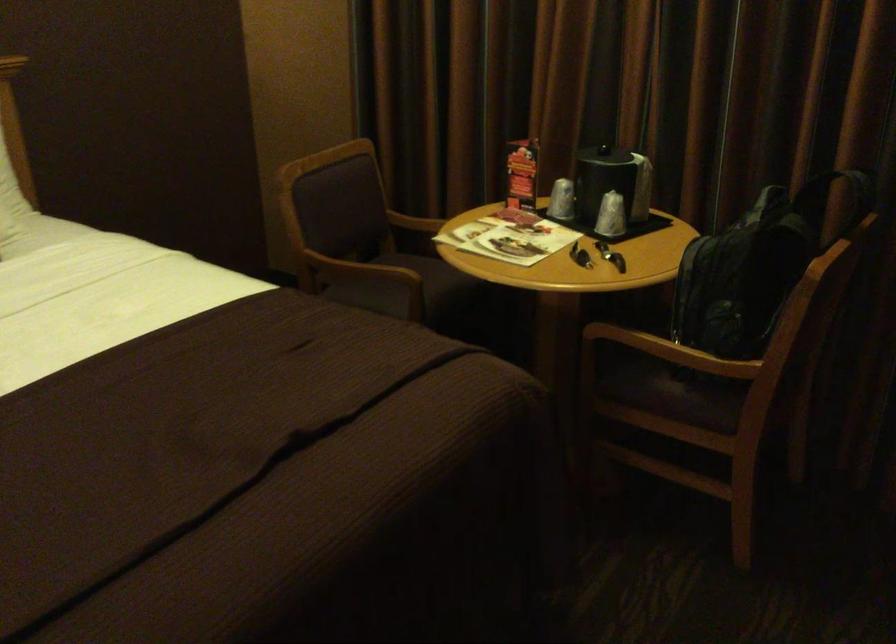
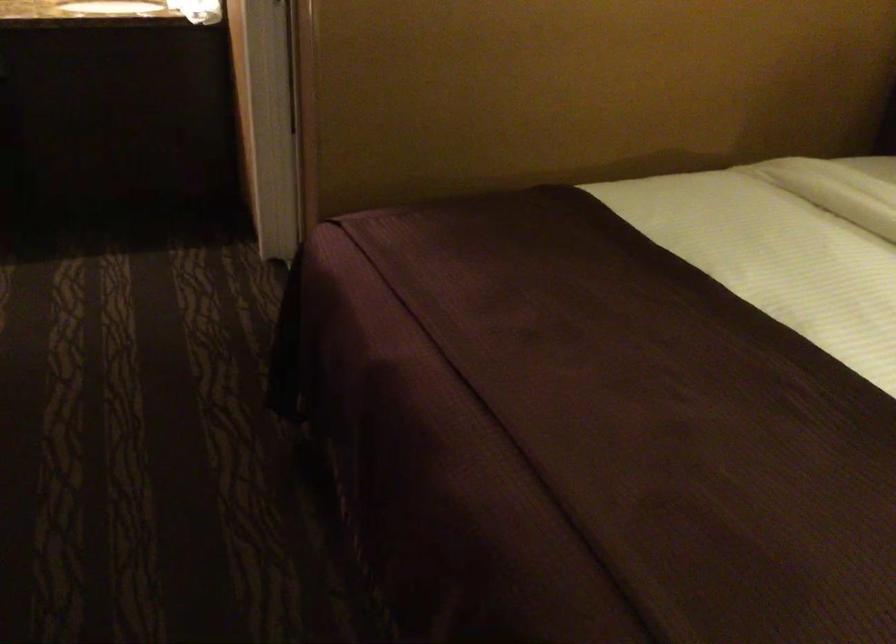
First-person continuous shooting, in which direction is the camera rotating?

The camera rotated toward left-down.